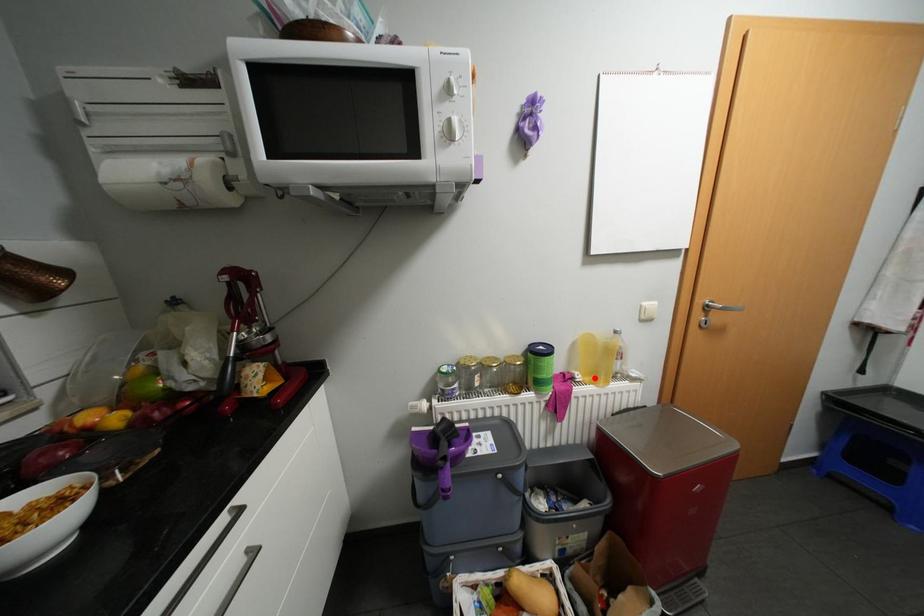
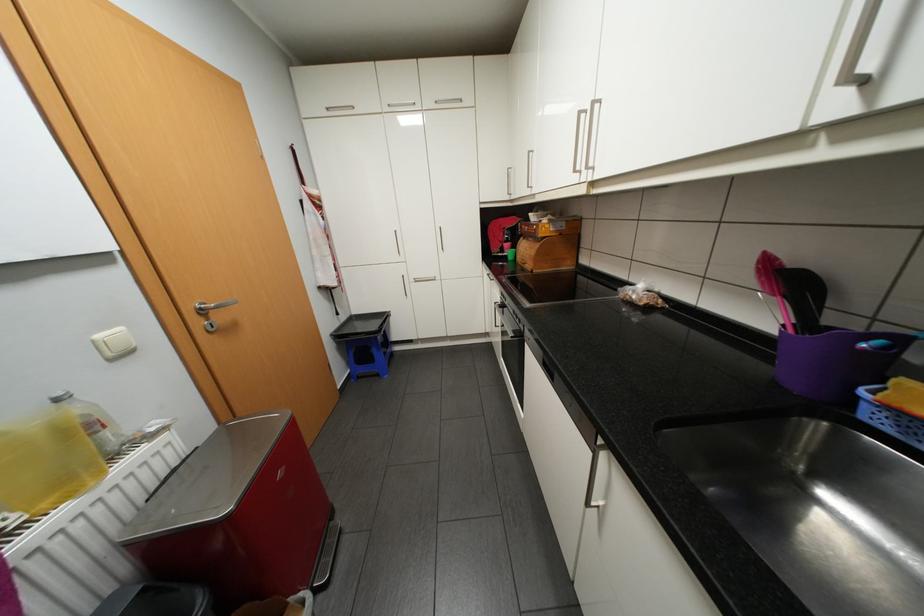
The point at the highlighted location is marked in the first image. Where is the corresponding point in the second image?

(53, 504)